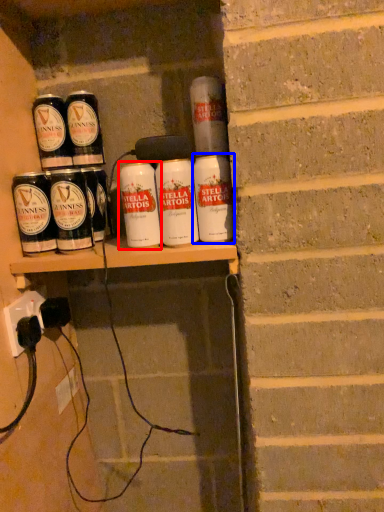
Question: Which of the following is the closest to the observer, tin can (highlighted by a red box) or tin can (highlighted by a blue box)?

Choices:
 (A) tin can
 (B) tin can

Answer: (B)